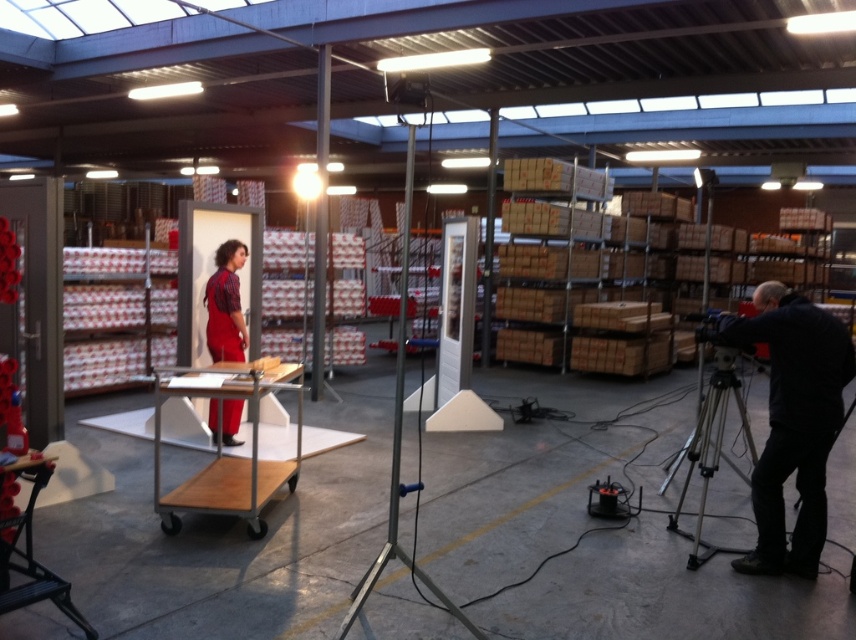
Question: Can you confirm if wooden trolley at center is positioned below matte red jumpsuit at center?

Choices:
 (A) yes
 (B) no

Answer: (A)

Question: Considering the real-world distances, which object is farthest from the silver metallic tripod at lower right?

Choices:
 (A) dark blue jacket at right
 (B) wooden trolley at center

Answer: (B)

Question: Which point is farther from the camera taking this photo?

Choices:
 (A) (223, 381)
 (B) (741, 428)
 (C) (217, 355)

Answer: (B)

Question: Does silver metallic tripod at lower right have a larger size compared to matte red jumpsuit at center?

Choices:
 (A) yes
 (B) no

Answer: (A)

Question: Which of the following is the closest to the observer?

Choices:
 (A) dark blue jacket at right
 (B) wooden trolley at center

Answer: (A)

Question: Can you confirm if dark blue jacket at right is smaller than wooden trolley at center?

Choices:
 (A) yes
 (B) no

Answer: (A)